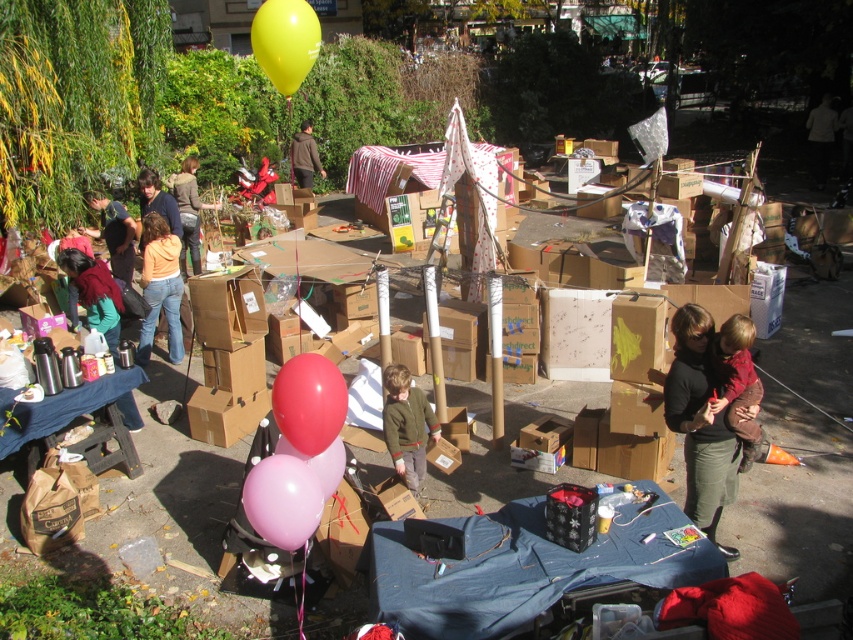
You are at a community event in the park and see a pink rubber balloon at lower center and a brown cardboard box at center. Which object is higher up in the image?

The pink rubber balloon at lower center is above the brown cardboard box at center, so it is higher up in the image.

Looking at this image, you are organizing a community event and need to ensure that the pink rubber balloon at lower center and the orange cotton shirt at center can fit on a 1.2 meter wide table. Based on their sizes, will both items fit side by side?

The pink rubber balloon at lower center has a lesser width compared to orange cotton shirt at center. However, without knowing the exact widths of both items, it is impossible to determine if they will fit on a 1.2 meter wide table. Additional measurements are needed.